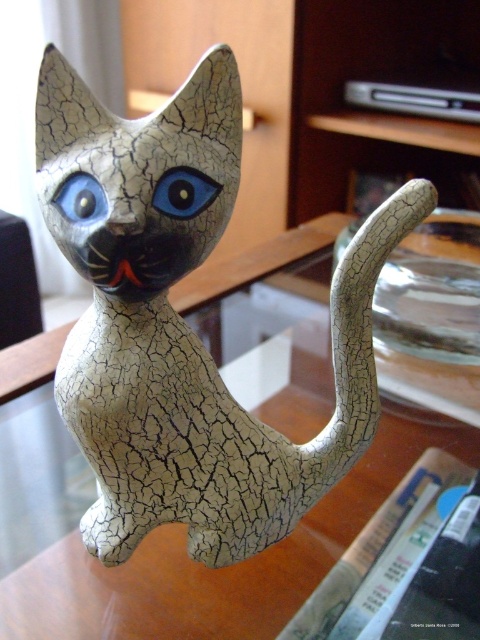
You are an art restorer examining the cracked ceramic cat at center and the blue glossy eye at center. Which object is positioned closer to your viewpoint?

The cracked ceramic cat at center is closer to the viewer than the blue glossy eye at center.

You are a museum curator arranging an exhibit. You have a cracked ceramic cat at center and a blue glossy eye at center. You need to place them on a shelf that can only accommodate items up to 30 cm in width. Which item requires more careful consideration regarding its width?

The cracked ceramic cat at center requires more careful consideration because it might be wider than the blue glossy eye at center, so it could exceed the shelf width limit of 30 cm.

In the scene shown: You are an interior designer assessing the placement of the cracked ceramic cat at center and the blue glossy eye at center on a shelf. Which object occupies more vertical space on the shelf?

The cracked ceramic cat at center is taller than the blue glossy eye at center, so it occupies more vertical space on the shelf.